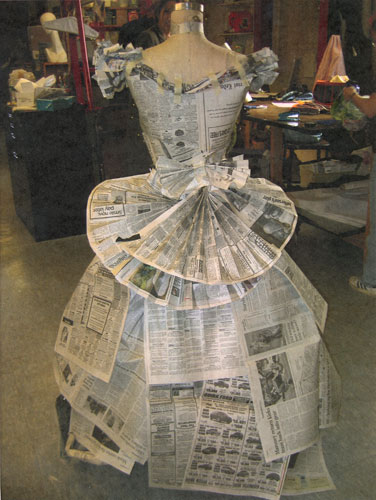
Where is `newspaper`? newspaper is located at coordinates 148,129.